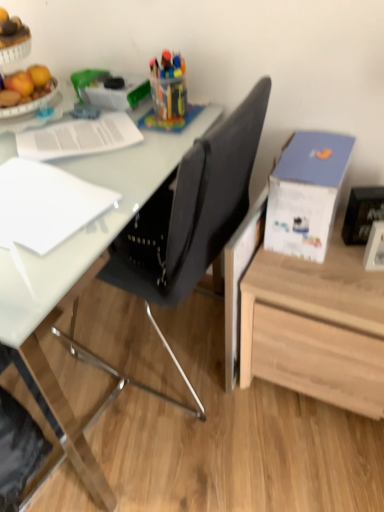
Where is `free space above white paper at left, which ranks as the second notebook in back-to-front order (from a real-world perspective)`? free space above white paper at left, which ranks as the second notebook in back-to-front order (from a real-world perspective) is located at coordinates (35, 195).